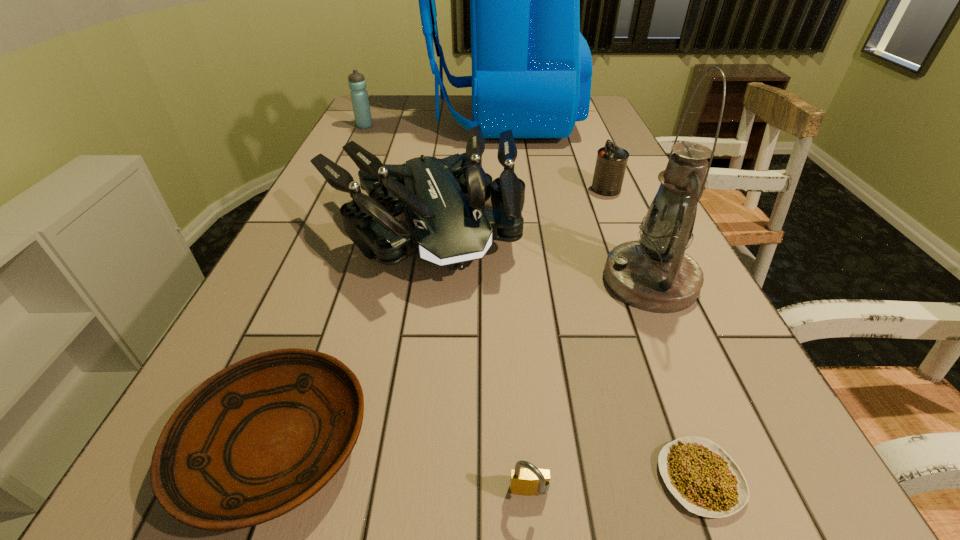
At what (x,y) coordinates should I click in order to perform the action: click on vacant space located 0.310m on the front of the seventh shortest object. Please return your answer as a coordinate pair (x, y). Looking at the image, I should click on 736,478.

The width and height of the screenshot is (960, 540). What are the coordinates of `vacant area situated on the front of the water bottle` in the screenshot? It's located at (343, 170).

Where is `vacant area situated on the back of the drone`? This screenshot has width=960, height=540. vacant area situated on the back of the drone is located at coordinates (431, 170).

Identify the location of free space located 0.290m on the front of the fifth tallest object. (639, 267).

The width and height of the screenshot is (960, 540). I want to click on free space located 0.290m on the back of the shortest object, so click(634, 301).

Locate an element on the screen. This screenshot has width=960, height=540. object at the far edge is located at coordinates (531, 67).

Locate an element on the screen. This screenshot has height=540, width=960. object present at the near edge is located at coordinates (699, 473).

Where is `water bottle present at the left edge`? water bottle present at the left edge is located at coordinates (359, 96).

Where is `drone at the left edge`? The height and width of the screenshot is (540, 960). drone at the left edge is located at coordinates (446, 223).

Locate an element on the screen. backpack that is at the right edge is located at coordinates (531, 67).